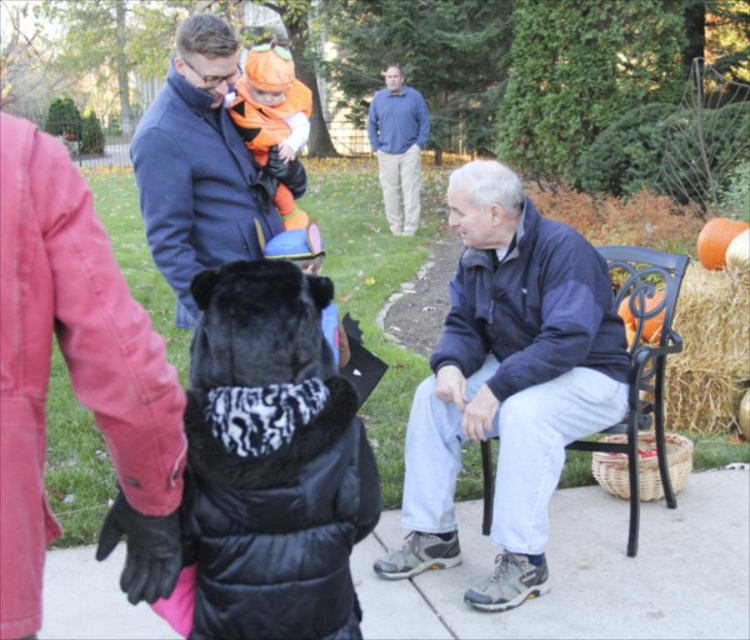
You are standing at the point marked as point (507, 381) in the image. What object is located exactly at that point?

The navy blue jacket at center is located exactly at point (507, 381).

You are standing in the backyard and see the navy blue jacket at center and the haybrown at right. Which object is closer to the ground?

The navy blue jacket at center is closer to the ground because it is below haybrown at right.

You are organizing a small outdoor event and need to place a large centerpiece on the black wrought iron chair at right. Based on the scene, will the blue cotton shirt at upper center interfere with the placement?

The black wrought iron chair at right occupies less space than the blue cotton shirt at upper center, so placing a large centerpiece on the chair might be possible, but the shirt could still interfere depending on its position relative to the chair.